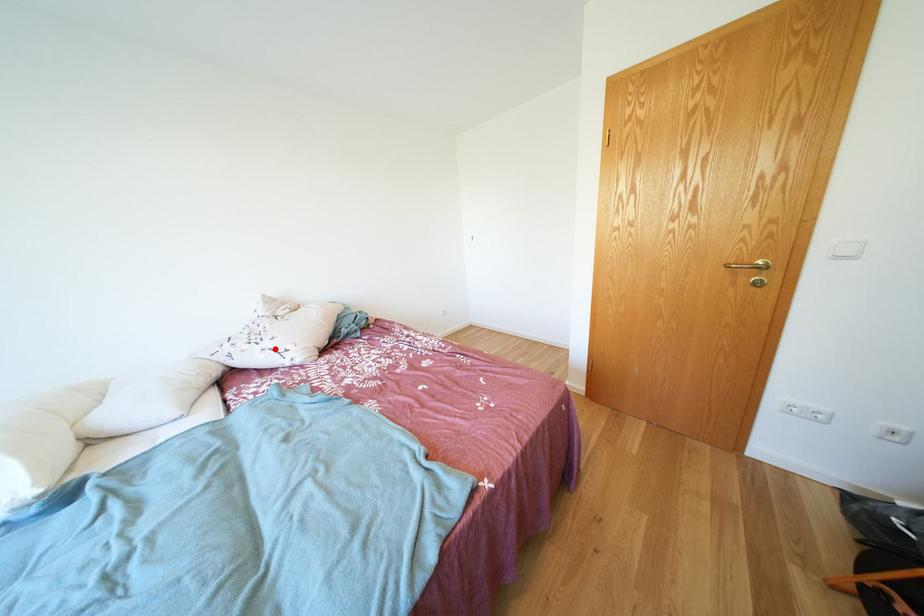
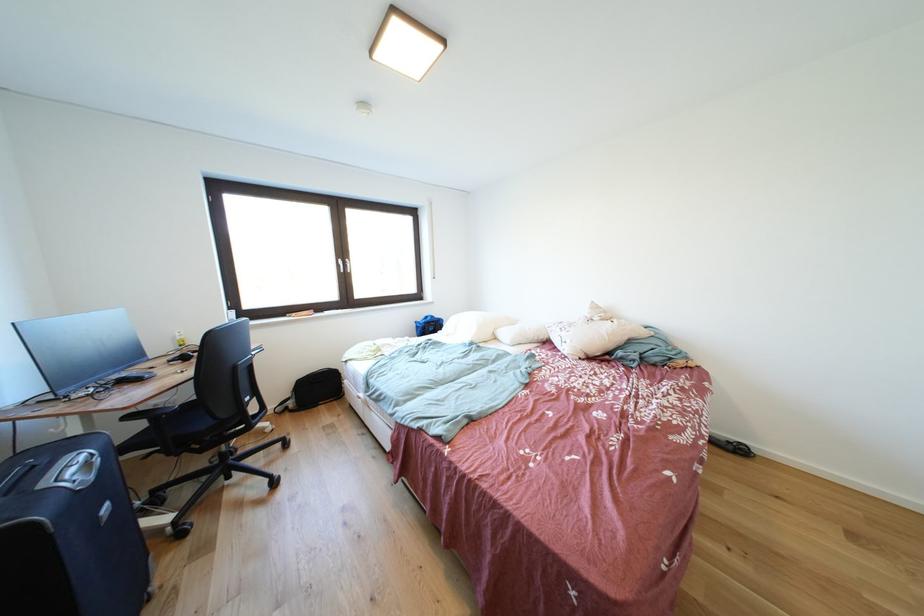
Find the pixel in the second image that matches the highlighted location in the first image.

(572, 338)